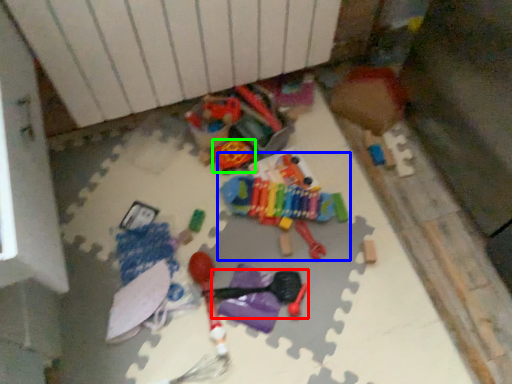
Question: Which is nearer to the toy (highlighted by a red box)? toy (highlighted by a blue box) or toy (highlighted by a green box).

Choices:
 (A) toy
 (B) toy

Answer: (A)